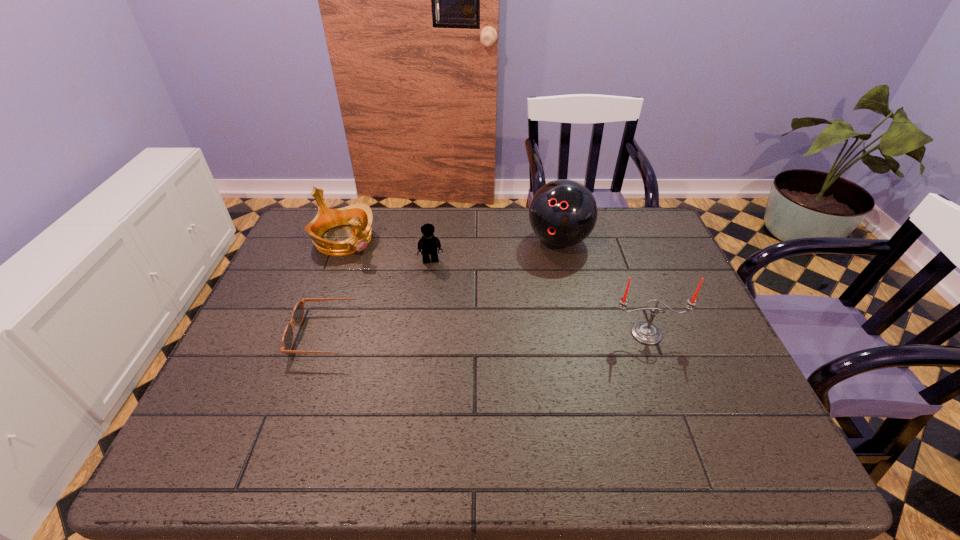
I want to click on sunglasses, so pos(298,312).

Identify the location of candle. The height and width of the screenshot is (540, 960). (646, 333).

At what (x,y) coordinates should I click in order to perform the action: click on bowling ball. Please return your answer as a coordinate pair (x, y). Looking at the image, I should click on (562, 213).

Image resolution: width=960 pixels, height=540 pixels. What are the coordinates of `Lego` in the screenshot? It's located at point(429,244).

Where is `tiara`? tiara is located at coordinates (359, 216).

Locate an element on the screen. free space located on the front-facing side of the sunglasses is located at coordinates (268, 335).

Where is `vacant space situated 0.130m on the front-facing side of the sunglasses`? vacant space situated 0.130m on the front-facing side of the sunglasses is located at coordinates (244, 335).

I want to click on free location located on the front-facing side of the candle, so click(660, 369).

Where is `free space located 0.240m on the surface of the bowling ball near the finger holes`? free space located 0.240m on the surface of the bowling ball near the finger holes is located at coordinates (516, 311).

Find the location of a particular element. This screenshot has height=540, width=960. vacant space situated 0.050m on the surface of the bowling ball near the finger holes is located at coordinates (542, 268).